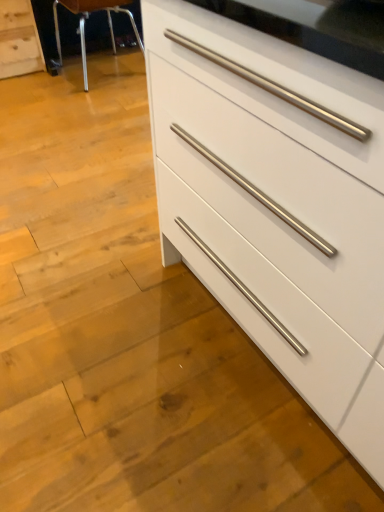
Question: Does point (26, 44) appear closer or farther from the camera than point (183, 135)?

Choices:
 (A) closer
 (B) farther

Answer: (B)

Question: From the image's perspective, is white matte chest of drawers at lower left, which ranks as the first chest of drawers in back-to-front order, above or below white glossy chest of drawers at center, the first chest of drawers in the right-to-left sequence?

Choices:
 (A) below
 (B) above

Answer: (B)

Question: Considering the real-world distances, which object is closest to the white matte chest of drawers at lower left, the first chest of drawers from the top?

Choices:
 (A) metallic silver bar stool at upper left
 (B) white glossy chest of drawers at center, the first chest of drawers in the right-to-left sequence

Answer: (A)

Question: Estimate the real-world distances between objects in this image. Which object is farther from the metallic silver bar stool at upper left?

Choices:
 (A) white matte chest of drawers at lower left, the first chest of drawers from the top
 (B) white glossy chest of drawers at center, the 2th chest of drawers positioned from the left

Answer: (B)